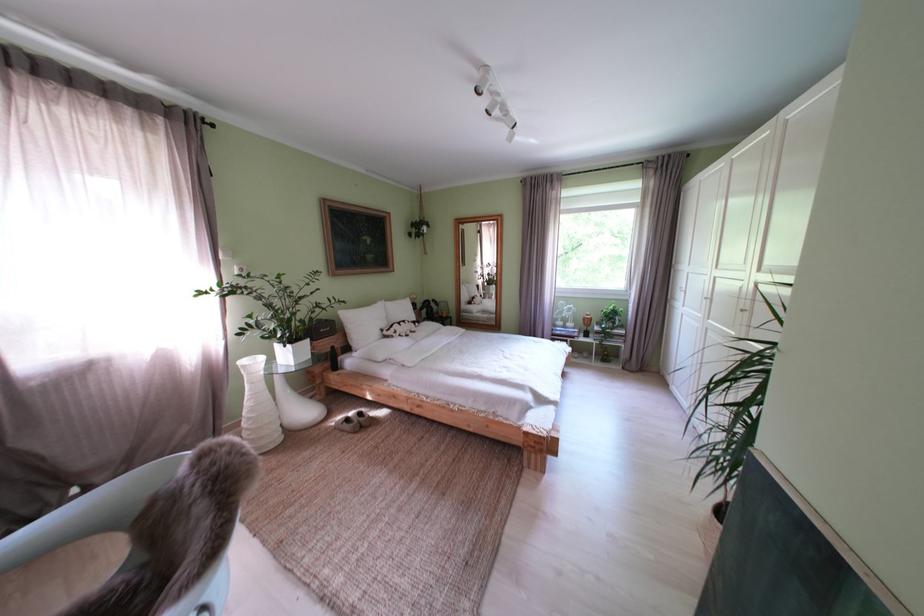
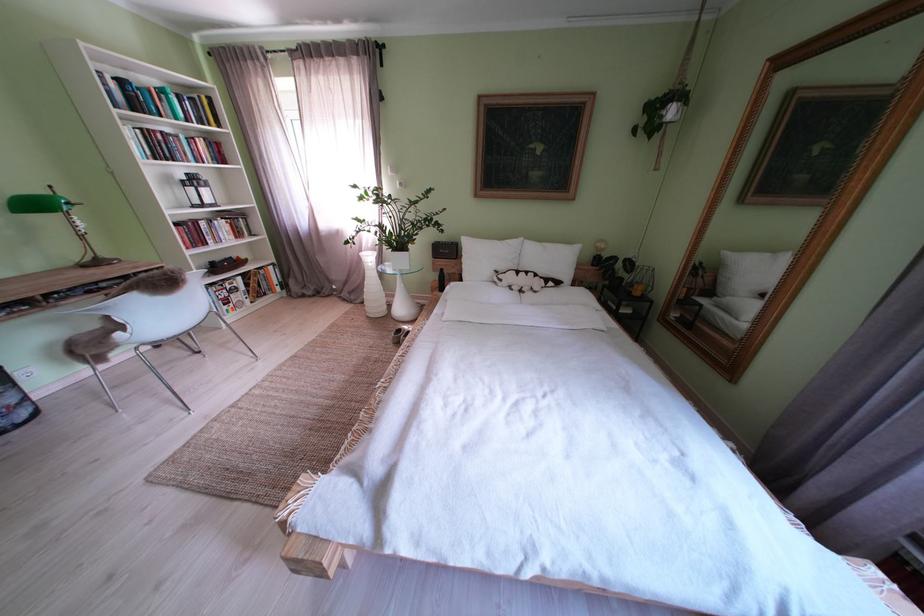
Locate, in the second image, the point that corresponds to the point at 456,321 in the first image.

(648, 299)